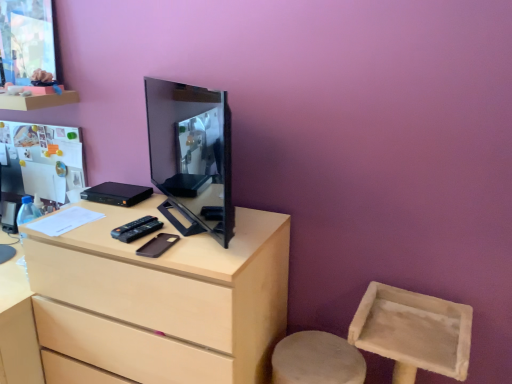
Locate an element on the screen. Image resolution: width=512 pixels, height=384 pixels. vacant space that is to the left of black glossy monitor at center is located at coordinates (122, 213).